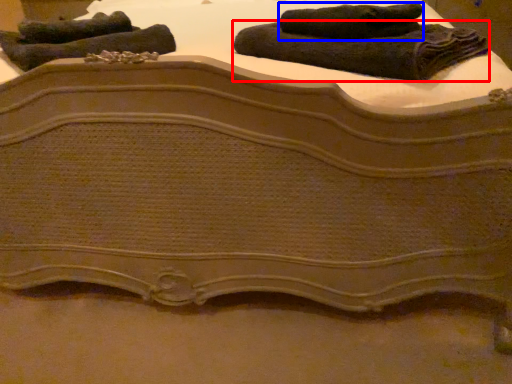
Question: Among these objects, which one is farthest to the camera, towel (highlighted by a red box) or towel (highlighted by a blue box)?

Choices:
 (A) towel
 (B) towel

Answer: (B)